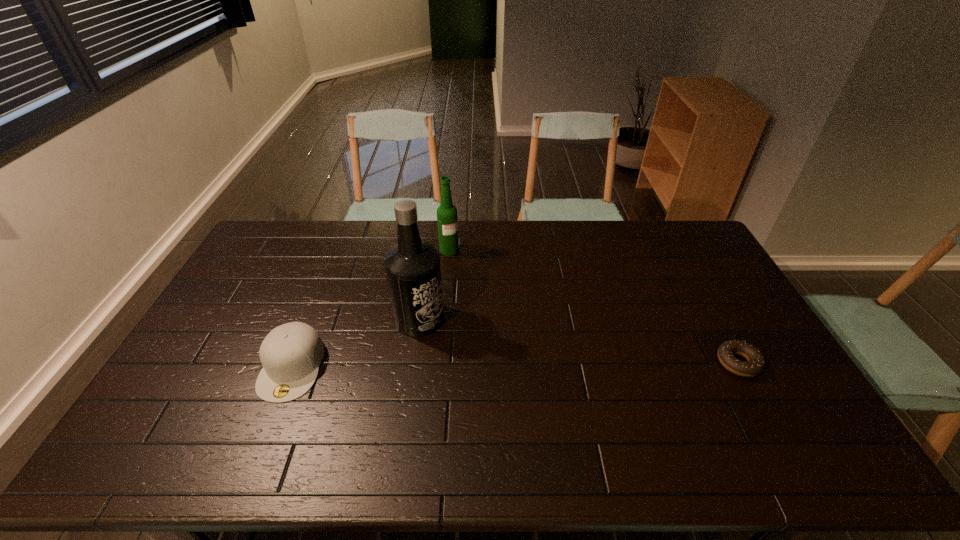
Where is `blank region between the doughnut and the farthest object`? blank region between the doughnut and the farthest object is located at coordinates (593, 306).

What are the coordinates of `vacant area that lies between the tallest object and the shortest object` in the screenshot? It's located at (579, 341).

Locate an element on the screen. vacant area that lies between the leftmost object and the liquor is located at coordinates (355, 342).

Select which object appears as the third closest to the cap. Please provide its 2D coordinates. Your answer should be formatted as a tuple, i.e. [(x, y)], where the tuple contains the x and y coordinates of a point satisfying the conditions above.

[(756, 363)]

Locate which object ranks in proximity to the second tallest object. Please provide its 2D coordinates. Your answer should be formatted as a tuple, i.e. [(x, y)], where the tuple contains the x and y coordinates of a point satisfying the conditions above.

[(412, 267)]

You are a GUI agent. You are given a task and a screenshot of the screen. Output one action in this format:
    pyautogui.click(x=<x>, y=<y>)
    Task: Click on the free point that satisfies the following two spatial constraints: 1. on the front side of the second tallest object; 2. on the left side of the shortest object
    
    Given the screenshot: What is the action you would take?
    pyautogui.click(x=440, y=363)